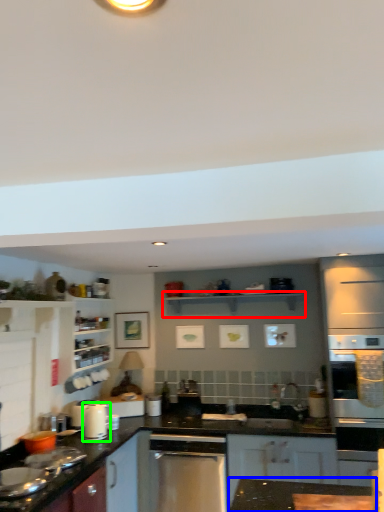
Question: Which object is positioned farthest from shelf (highlighted by a red box)? Select from countertop (highlighted by a blue box) and kitchen appliance (highlighted by a green box).

Choices:
 (A) countertop
 (B) kitchen appliance

Answer: (A)